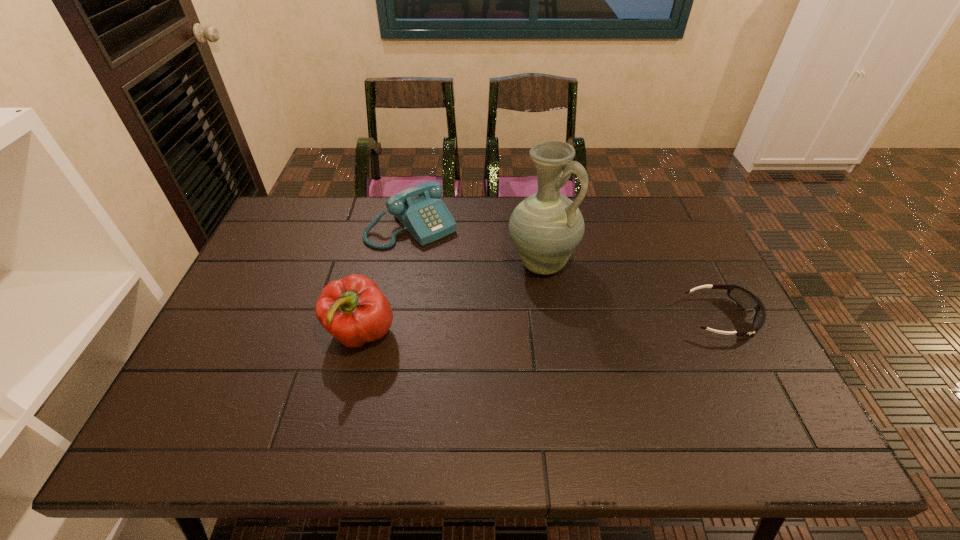
Identify the location of bell pepper. The width and height of the screenshot is (960, 540). (352, 309).

The height and width of the screenshot is (540, 960). I want to click on the rightmost object, so click(x=744, y=298).

You are a GUI agent. You are given a task and a screenshot of the screen. Output one action in this format:
    pyautogui.click(x=<x>, y=<y>)
    Task: Click on the goggles
    The height and width of the screenshot is (540, 960).
    Given the screenshot: What is the action you would take?
    pyautogui.click(x=744, y=298)

Find the location of a particular element. This screenshot has width=960, height=540. pitcher is located at coordinates (546, 227).

In order to click on the tallest object in this screenshot , I will do `click(546, 227)`.

You are a GUI agent. You are given a task and a screenshot of the screen. Output one action in this format:
    pyautogui.click(x=<x>, y=<y>)
    Task: Click on the third tallest object
    This screenshot has width=960, height=540.
    Given the screenshot: What is the action you would take?
    pyautogui.click(x=419, y=209)

In order to click on free space located 0.310m on the back of the bell pepper in this screenshot , I will do `click(385, 235)`.

Locate an element on the screen. Image resolution: width=960 pixels, height=540 pixels. vacant position located on the handle side of the pitcher is located at coordinates (658, 397).

Find the location of a particular element. The width and height of the screenshot is (960, 540). vacant space located on the handle side of the pitcher is located at coordinates (612, 344).

At what (x,y) coordinates should I click in order to perform the action: click on vacant area located on the handle side of the pitcher. Please return your answer as a coordinate pair (x, y). Looking at the image, I should click on (602, 333).